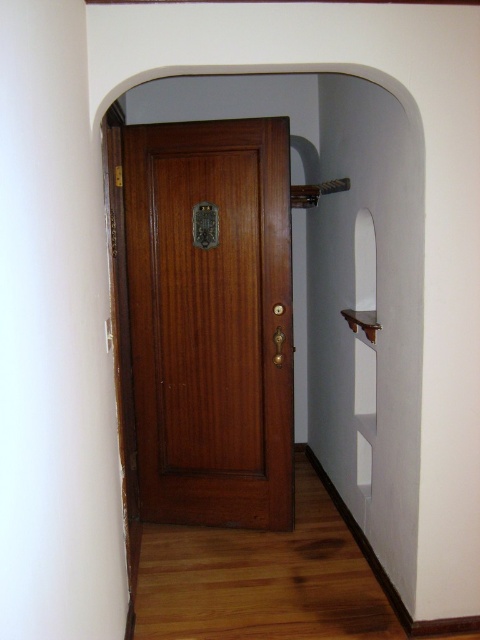
You are standing in front of a white archway. You need to locate the polished wood door at center. Where is it positioned relative to the archway?

The polished wood door at center is positioned at point (x=212, y=321) relative to the archway.

You are moving a 60 cm wide painting and want to hang it between the polished wood door at center and the wooden door at center. Can the painting fit in the space between them?

The distance between the polished wood door at center and the wooden door at center is 61.64 centimeters. Since the painting is 60 cm wide, it can fit in the space between them as the available space is slightly wider than the painting.

You are standing in front of the wooden door set within a white archway. You notice two doors labeled as the polished wood door at center and the wooden door at center. Which door is positioned lower in the scene?

The polished wood door at center is positioned lower than the wooden door at center.